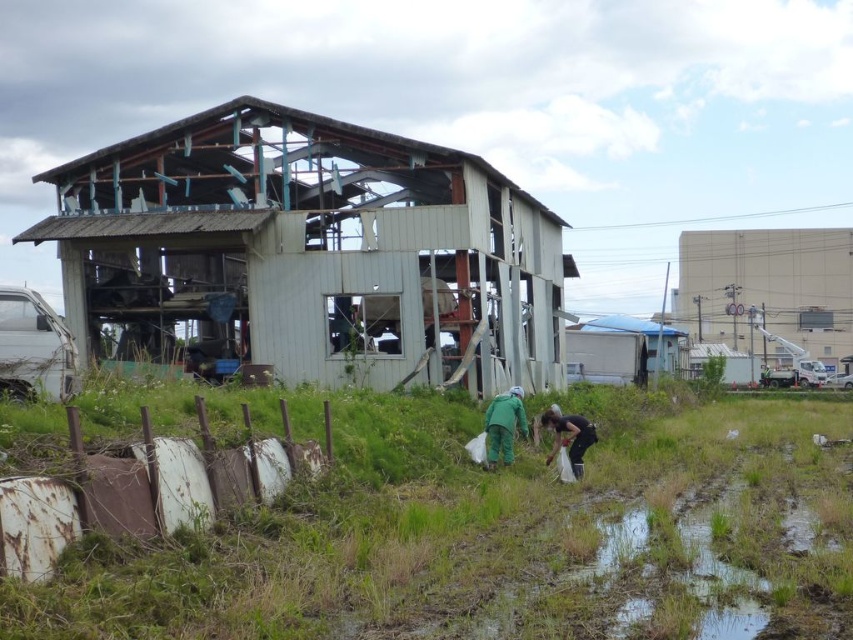
Question: Which point is closer to the camera taking this photo?

Choices:
 (A) (428, 152)
 (B) (485, 412)
 (C) (549, 419)

Answer: (C)

Question: Which of the following is the closest to the observer?

Choices:
 (A) dark green fabric at lower center
 (B) white concrete building at upper right
 (C) blue tarpaulin hut at right

Answer: (A)

Question: Which of the following is the closest to the observer?

Choices:
 (A) (635, 435)
 (B) (577, 468)
 (C) (422, 317)
 (D) (578, 340)

Answer: (B)

Question: From the image, what is the correct spatial relationship of white concrete building at upper right in relation to dark green fabric at lower center?

Choices:
 (A) right
 (B) left

Answer: (A)

Question: Is green grass at lower center bigger than weathered wood hut at center?

Choices:
 (A) yes
 (B) no

Answer: (B)

Question: Does white concrete building at upper right have a smaller size compared to blue tarpaulin hut at right?

Choices:
 (A) yes
 (B) no

Answer: (B)